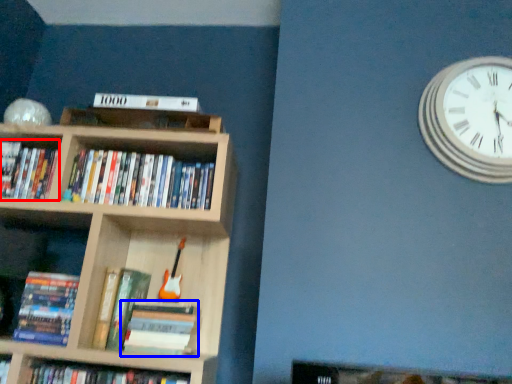
Question: Among these objects, which one is nearest to the camera, book (highlighted by a red box) or book (highlighted by a blue box)?

Choices:
 (A) book
 (B) book

Answer: (B)